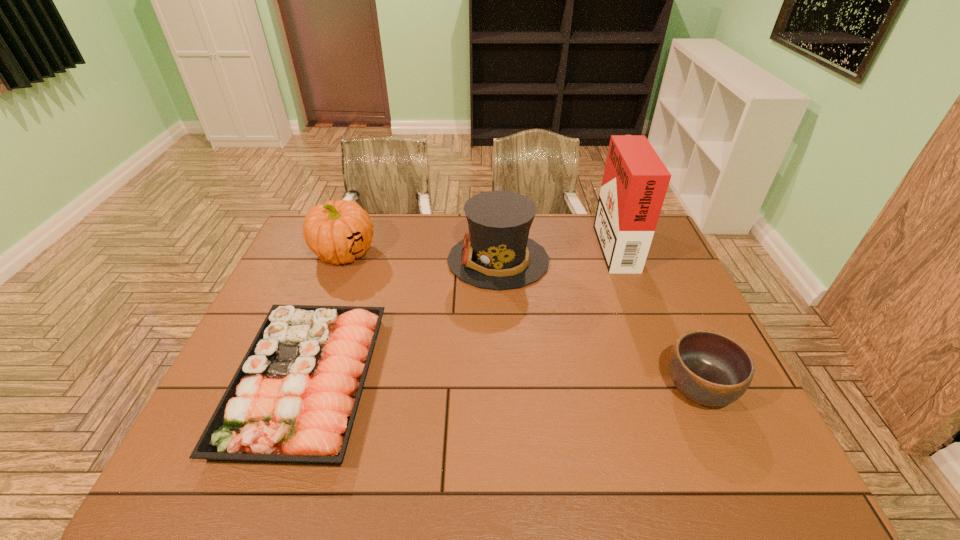
The height and width of the screenshot is (540, 960). In order to click on vacant position in the image that satisfies the following two spatial constraints: 1. on the front-facing side of the cigarette case; 2. on the right side of the second shortest object in this screenshot , I will do `click(669, 388)`.

Where is `blank space that satisfies the following two spatial constraints: 1. on the front-facing side of the tallest object; 2. on the left side of the bowl`? The height and width of the screenshot is (540, 960). blank space that satisfies the following two spatial constraints: 1. on the front-facing side of the tallest object; 2. on the left side of the bowl is located at coordinates (669, 388).

The width and height of the screenshot is (960, 540). I want to click on vacant point that satisfies the following two spatial constraints: 1. on the surface of the platter; 2. on the left side of the pumpkin, so click(x=296, y=381).

Find the location of a particular element. The image size is (960, 540). blank area in the image that satisfies the following two spatial constraints: 1. on the front-facing side of the tallest object; 2. on the surface of the pumpkin is located at coordinates (617, 252).

I want to click on vacant area in the image that satisfies the following two spatial constraints: 1. on the surface of the pumpkin; 2. on the left side of the fourth tallest object, so (x=293, y=388).

Locate an element on the screen. This screenshot has width=960, height=540. free spot that satisfies the following two spatial constraints: 1. on the front-facing side of the cigarette case; 2. on the surface of the pumpkin is located at coordinates (617, 252).